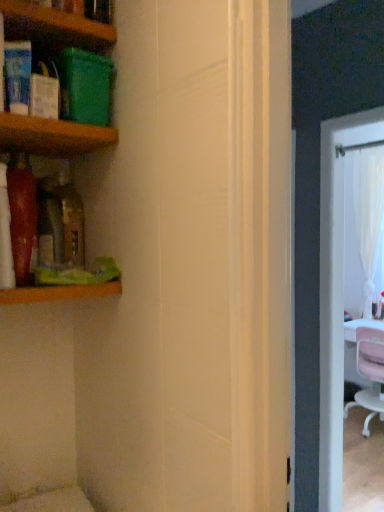
Question: From the image's perspective, is wooden shelf at upper left, the 1th shelf positioned from the top, over wooden shelf at upper left, the 2th shelf viewed from the top?

Choices:
 (A) no
 (B) yes

Answer: (B)

Question: Is wooden shelf at upper left, which appears as the third shelf when ordered from the bottom, facing away from wooden shelf at upper left, the 2th shelf viewed from the top?

Choices:
 (A) no
 (B) yes

Answer: (A)

Question: Considering the relative sizes of wooden shelf at upper left, which appears as the third shelf when ordered from the bottom, and wooden shelf at upper left, arranged as the 2th shelf when ordered from the bottom, in the image provided, is wooden shelf at upper left, which appears as the third shelf when ordered from the bottom, shorter than wooden shelf at upper left, arranged as the 2th shelf when ordered from the bottom,?

Choices:
 (A) no
 (B) yes

Answer: (A)

Question: Is wooden shelf at upper left, which appears as the third shelf when ordered from the bottom, at the left side of wooden shelf at upper left, the 2th shelf viewed from the top?

Choices:
 (A) no
 (B) yes

Answer: (B)

Question: Is wooden shelf at upper left, which appears as the third shelf when ordered from the bottom, directly adjacent to wooden shelf at upper left, the 2th shelf viewed from the top?

Choices:
 (A) no
 (B) yes

Answer: (A)

Question: Based on their sizes in the image, would you say wooden shelf at left, the third shelf from the top, is bigger or smaller than wooden shelf at upper left, the 1th shelf positioned from the top?

Choices:
 (A) small
 (B) big

Answer: (A)

Question: Considering their positions, is wooden shelf at left, the 1th shelf in the bottom-to-top sequence, located in front of or behind wooden shelf at upper left, the 1th shelf positioned from the top?

Choices:
 (A) behind
 (B) front

Answer: (A)

Question: In terms of width, does wooden shelf at left, the 1th shelf in the bottom-to-top sequence, look wider or thinner when compared to wooden shelf at upper left, the 1th shelf positioned from the top?

Choices:
 (A) wide
 (B) thin

Answer: (B)

Question: From a real-world perspective, relative to wooden shelf at upper left, the 1th shelf positioned from the top, is wooden shelf at left, the third shelf from the top, vertically above or below?

Choices:
 (A) below
 (B) above

Answer: (A)

Question: Relative to pink fabric chair at right, is wooden shelf at upper left, which appears as the third shelf when ordered from the bottom, in front or behind?

Choices:
 (A) behind
 (B) front

Answer: (B)

Question: Considering the positions of wooden shelf at upper left, which appears as the third shelf when ordered from the bottom, and pink fabric chair at right in the image, is wooden shelf at upper left, which appears as the third shelf when ordered from the bottom, wider or thinner than pink fabric chair at right?

Choices:
 (A) thin
 (B) wide

Answer: (A)

Question: From a real-world perspective, is wooden shelf at upper left, the 1th shelf positioned from the top, above or below pink fabric chair at right?

Choices:
 (A) above
 (B) below

Answer: (A)

Question: In the image, is wooden shelf at upper left, which appears as the third shelf when ordered from the bottom, on the left side or the right side of pink fabric chair at right?

Choices:
 (A) left
 (B) right

Answer: (A)

Question: In terms of width, does pink fabric chair at right look wider or thinner when compared to wooden shelf at left, the 1th shelf in the bottom-to-top sequence?

Choices:
 (A) thin
 (B) wide

Answer: (B)

Question: Is point (362, 401) positioned closer to the camera than point (9, 290)?

Choices:
 (A) farther
 (B) closer

Answer: (A)